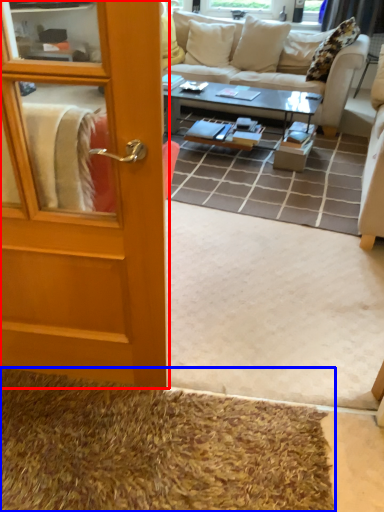
Question: Among these objects, which one is farthest to the camera, door (highlighted by a red box) or doormat (highlighted by a blue box)?

Choices:
 (A) door
 (B) doormat

Answer: (B)